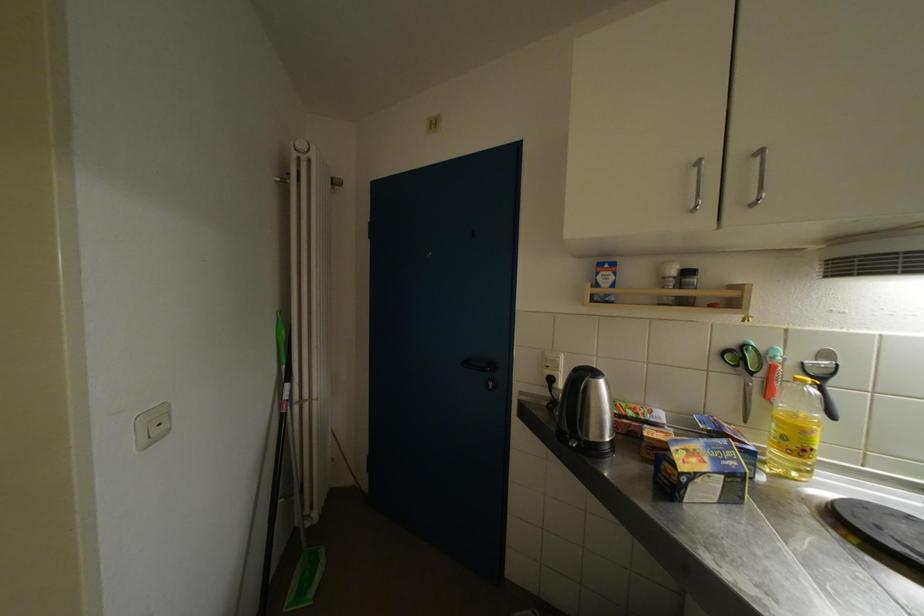
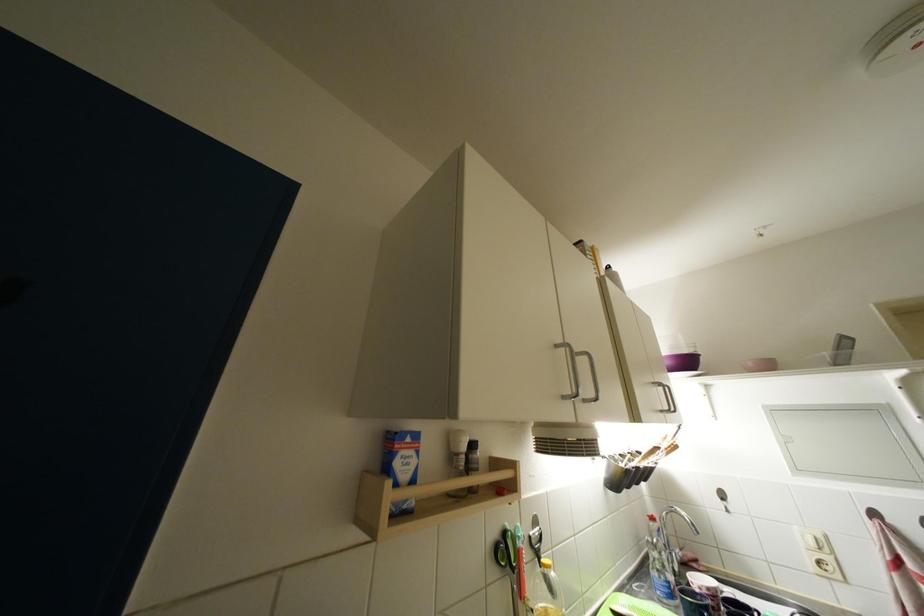
Locate, in the second image, the point that corresponds to pixel 606 282 in the first image.

(404, 467)